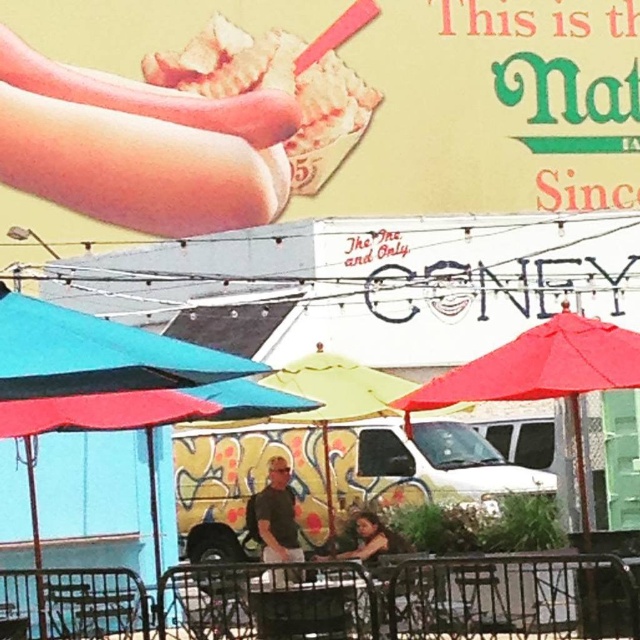
Question: Among these objects, which one is nearest to the camera?

Choices:
 (A) dark gray shirt at center
 (B) golden crispy waffle at upper center
 (C) matte brown hot dog at upper left
 (D) red fabric umbrella at right

Answer: (D)

Question: Does golden crispy waffle at upper center appear on the left side of red fabric umbrella at right?

Choices:
 (A) no
 (B) yes

Answer: (B)

Question: Which of the following is the closest to the observer?

Choices:
 (A) (292, 508)
 (B) (342, 22)
 (C) (257, 140)

Answer: (A)

Question: Is red fabric umbrella at right thinner than dark gray shirt at center?

Choices:
 (A) yes
 (B) no

Answer: (B)

Question: Can you confirm if golden crispy waffle at upper center is positioned to the left of dark gray shirt at center?

Choices:
 (A) no
 (B) yes

Answer: (B)

Question: Estimate the real-world distances between objects in this image. Which object is farther from the dark gray shirt at center?

Choices:
 (A) matte brown hot dog at upper left
 (B) teal fabric umbrella at left
 (C) golden crispy waffle at upper center
 (D) red fabric umbrella at right

Answer: (C)